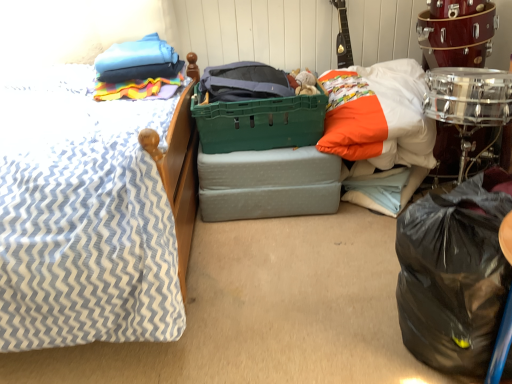
Question: Is shiny silver drum at right in contact with black plastic bag at lower right?

Choices:
 (A) yes
 (B) no

Answer: (B)

Question: Is black plastic bag at lower right completely or partially inside shiny silver drum at right?

Choices:
 (A) no
 (B) yes

Answer: (A)

Question: Is shiny silver drum at right to the right of black plastic bag at lower right from the viewer's perspective?

Choices:
 (A) yes
 (B) no

Answer: (A)

Question: From a real-world perspective, is shiny silver drum at right located beneath black plastic bag at lower right?

Choices:
 (A) yes
 (B) no

Answer: (B)

Question: Is shiny silver drum at right positioned in front of black plastic bag at lower right?

Choices:
 (A) yes
 (B) no

Answer: (B)

Question: Is green plastic storage box at center inside or outside of shiny silver drum at right?

Choices:
 (A) outside
 (B) inside

Answer: (A)

Question: From their relative heights in the image, would you say green plastic storage box at center is taller or shorter than shiny silver drum at right?

Choices:
 (A) tall
 (B) short

Answer: (B)

Question: Would you say green plastic storage box at center is to the left or to the right of shiny silver drum at right in the picture?

Choices:
 (A) right
 (B) left

Answer: (B)

Question: Is point (257, 157) closer or farther from the camera than point (485, 34)?

Choices:
 (A) farther
 (B) closer

Answer: (B)

Question: Considering the positions of point (371, 155) and point (294, 173), is point (371, 155) closer or farther from the camera than point (294, 173)?

Choices:
 (A) closer
 (B) farther

Answer: (B)

Question: Is white cotton pillow at upper right, which appears as the second pillow when viewed from the left, wider or thinner than green plastic storage box at center?

Choices:
 (A) thin
 (B) wide

Answer: (B)

Question: In terms of size, does white cotton pillow at upper right, marked as the first pillow in a right-to-left arrangement, appear bigger or smaller than green plastic storage box at center?

Choices:
 (A) small
 (B) big

Answer: (B)

Question: Do you think white cotton pillow at upper right, marked as the first pillow in a right-to-left arrangement, is within green plastic storage box at center, or outside of it?

Choices:
 (A) outside
 (B) inside

Answer: (A)

Question: Is green plastic basket at center bigger or smaller than white cotton pillow at upper right, which appears as the second pillow when viewed from the left?

Choices:
 (A) big
 (B) small

Answer: (B)

Question: Is point (256, 132) closer or farther from the camera than point (395, 102)?

Choices:
 (A) farther
 (B) closer

Answer: (A)